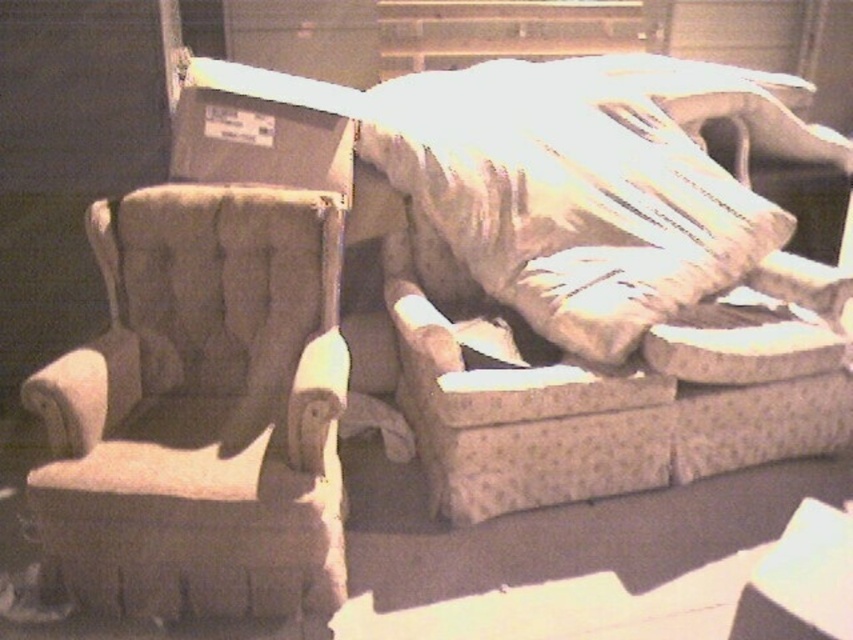
Does tufted fabric armchair at left appear under matte gray cardboard box at upper left?

Indeed, tufted fabric armchair at left is positioned under matte gray cardboard box at upper left.

Between point (242, 452) and point (215, 173), which one is positioned behind?

The point (215, 173) is behind.

Identify the location of tufted fabric armchair at left. (201, 410).